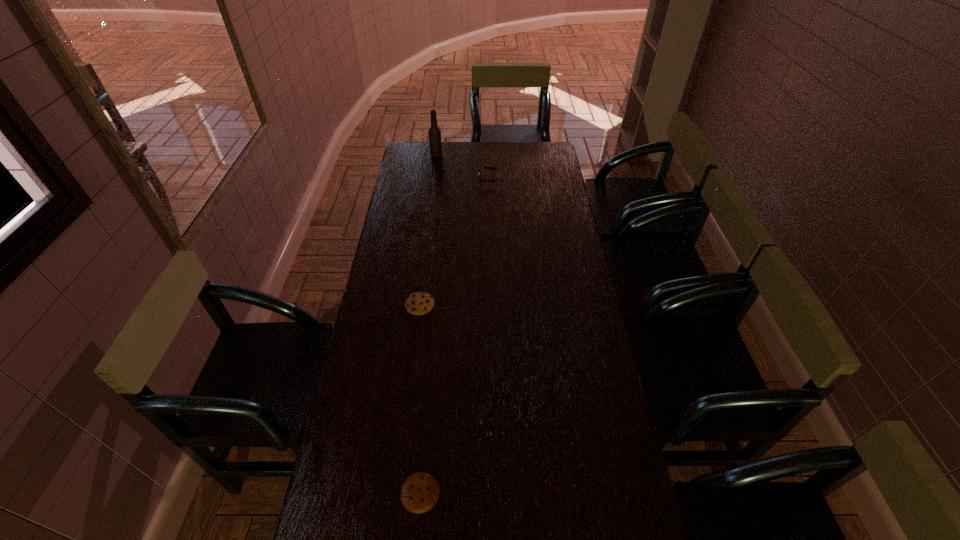
Locate an element on the screen. The image size is (960, 540). blank space at the right edge is located at coordinates (560, 204).

At what (x,y) coordinates should I click in order to perform the action: click on vacant area that lies between the nearer cookie and the sunglasses. Please return your answer as a coordinate pair (x, y). Looking at the image, I should click on (455, 336).

The width and height of the screenshot is (960, 540). I want to click on vacant area between the tallest object and the nearest object, so click(x=428, y=323).

Find the location of a particular element. The image size is (960, 540). vacant area between the farther cookie and the rightmost object is located at coordinates (455, 242).

Image resolution: width=960 pixels, height=540 pixels. I want to click on vacant area that lies between the tallest object and the second farthest object, so tap(464, 167).

This screenshot has height=540, width=960. What are the coordinates of `vacant area that lies between the sunglasses and the second nearest object` in the screenshot? It's located at (455, 242).

Locate an element on the screen. The image size is (960, 540). vacant space that's between the nearest object and the third nearest object is located at coordinates (455, 336).

Image resolution: width=960 pixels, height=540 pixels. Find the location of `vacant area that lies between the taller cookie and the sunglasses`. vacant area that lies between the taller cookie and the sunglasses is located at coordinates (455, 242).

I want to click on vacant space that is in between the shorter cookie and the rightmost object, so click(x=455, y=336).

Identify the location of vacant space that is in between the rightmost object and the beer bottle. (464, 167).